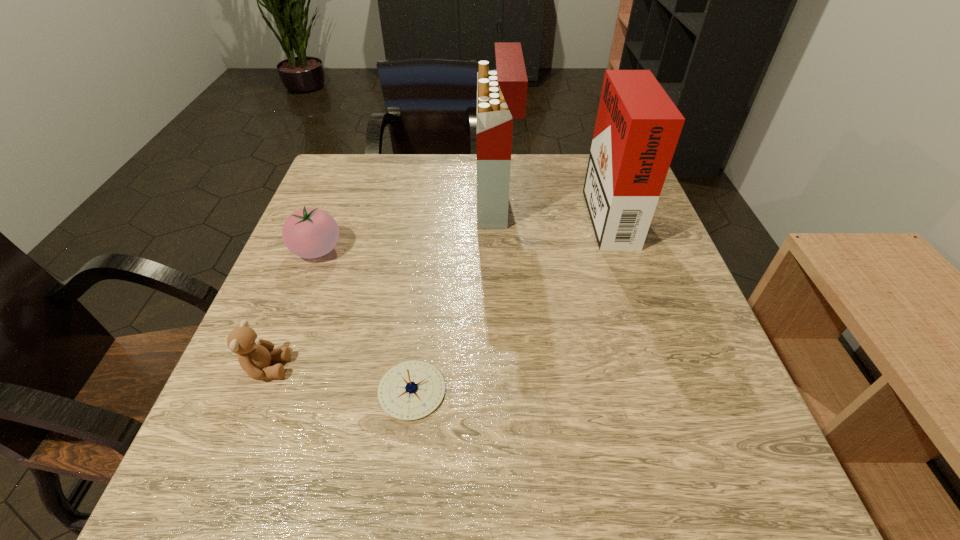
Where is `the second object from right to left`? Image resolution: width=960 pixels, height=540 pixels. the second object from right to left is located at coordinates (501, 94).

Locate an element on the screen. The image size is (960, 540). the rightmost object is located at coordinates (637, 129).

I want to click on tomato, so click(309, 233).

The width and height of the screenshot is (960, 540). In order to click on teddy bear in this screenshot , I will do `click(254, 354)`.

In order to click on compass in this screenshot , I will do `click(411, 390)`.

Locate an element on the screen. This screenshot has width=960, height=540. the third object from right to left is located at coordinates (411, 390).

Where is `vacant space situated 0.230m with the lid open on the fourth object from left to right`? Image resolution: width=960 pixels, height=540 pixels. vacant space situated 0.230m with the lid open on the fourth object from left to right is located at coordinates 387,202.

Where is `vacant space positioned 0.100m with the lid open on the fourth object from left to right`? vacant space positioned 0.100m with the lid open on the fourth object from left to right is located at coordinates 438,202.

Identify the location of vacant region located with the lid open on the fourth object from left to right. coord(411,202).

The image size is (960, 540). Find the location of `free spot located on the front-facing side of the right cigarette case`. free spot located on the front-facing side of the right cigarette case is located at coordinates (436, 212).